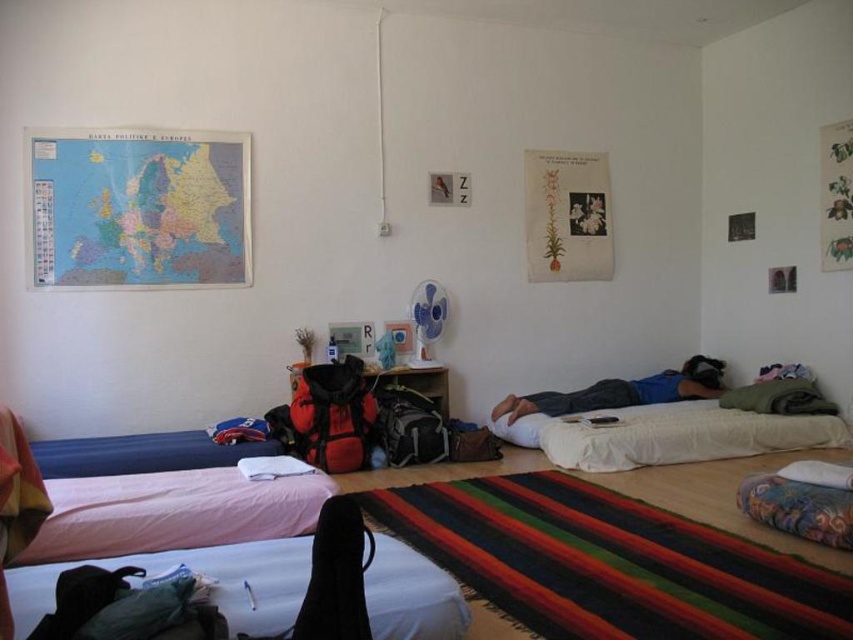
Question: Among these points, which one is nearest to the camera?

Choices:
 (A) (708, 378)
 (B) (782, 422)

Answer: (B)

Question: Can you confirm if white soft bed at lower right is positioned to the left of blue cotton shirt at center?

Choices:
 (A) no
 (B) yes

Answer: (A)

Question: Which of the following is the farthest from the observer?

Choices:
 (A) blue cotton shirt at center
 (B) white soft bed at lower right

Answer: (A)

Question: Which point is farther from the camera taking this photo?

Choices:
 (A) (601, 388)
 (B) (215, 564)

Answer: (A)

Question: Can you confirm if white soft bed at lower right is positioned to the left of blue cotton shirt at center?

Choices:
 (A) yes
 (B) no

Answer: (B)

Question: Is pink fabric bed at lower left smaller than white soft bed at lower right?

Choices:
 (A) yes
 (B) no

Answer: (B)